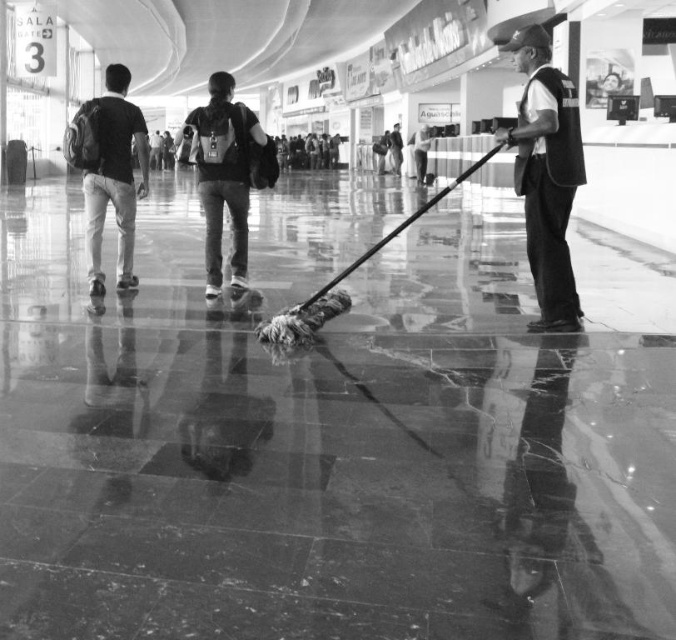
Question: Does matte black backpack at left have a greater width compared to matte black backpack at center?

Choices:
 (A) yes
 (B) no

Answer: (B)

Question: Which of the following is the farthest from the observer?

Choices:
 (A) (241, 145)
 (B) (558, 186)

Answer: (A)

Question: Is dark gray uniform at right closer to camera compared to matte black backpack at center?

Choices:
 (A) no
 (B) yes

Answer: (B)

Question: Is dark gray uniform at right bigger than matte black backpack at center?

Choices:
 (A) yes
 (B) no

Answer: (B)

Question: Which point is farther to the camera?

Choices:
 (A) (206, 224)
 (B) (560, 292)

Answer: (A)

Question: Which object appears closest to the camera in this image?

Choices:
 (A) matte black backpack at left
 (B) matte black backpack at center

Answer: (A)